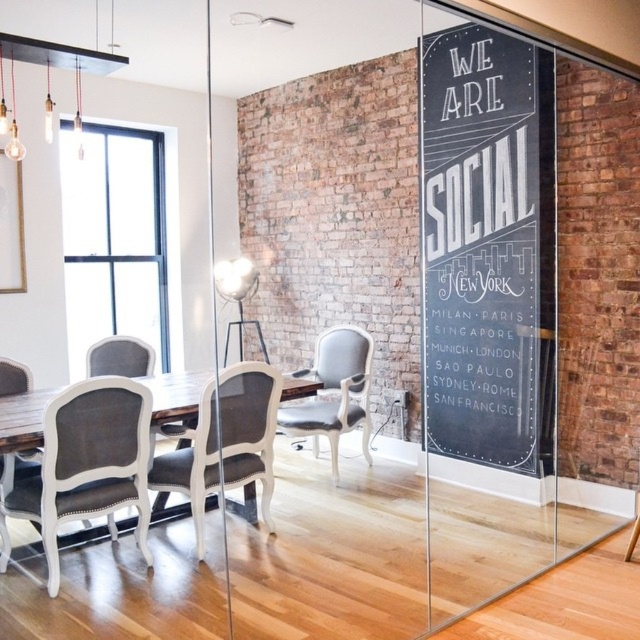
Question: In this image, where is transparent glass door at right located relative to gray fabric chair at lower left?

Choices:
 (A) below
 (B) above

Answer: (B)

Question: Can you confirm if gray fabric chair at lower left is positioned above matte gray chair at left?

Choices:
 (A) yes
 (B) no

Answer: (A)

Question: Can you confirm if transparent glass door at right is positioned to the left of gray fabric chair at lower left?

Choices:
 (A) yes
 (B) no

Answer: (B)

Question: Among these objects, which one is farthest from the camera?

Choices:
 (A) dark gray fabric chair at center
 (B) transparent glass door at right
 (C) matte gray chair at left

Answer: (A)

Question: Among these points, which one is nearest to the camera?

Choices:
 (A) (285, 376)
 (B) (70, 508)
 (C) (432, 220)
 (D) (356, 413)

Answer: (B)

Question: Which is nearer to the dark gray fabric chair at center?

Choices:
 (A) gray fabric chair at lower left
 (B) wooden table at center
 (C) transparent glass door at right

Answer: (A)